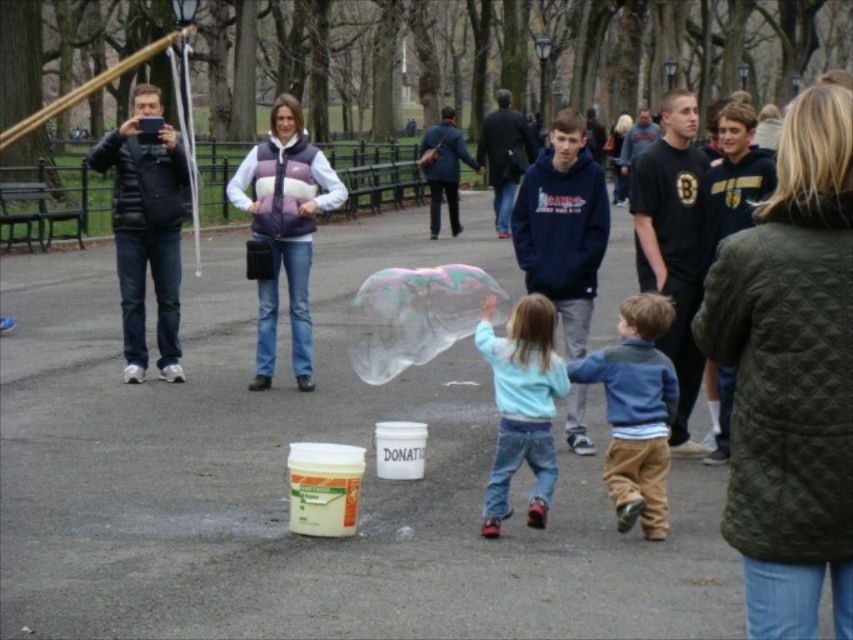
Question: Among these objects, which one is nearest to the camera?

Choices:
 (A) black cotton t-shirt at right
 (B) light blue fleece at center
 (C) blue fleece jacket at center

Answer: (C)

Question: Does black cotton t-shirt at right have a smaller size compared to blue fleece jacket at center?

Choices:
 (A) yes
 (B) no

Answer: (A)

Question: Does blue fleece jacket at center have a larger size compared to light blue fleece at center?

Choices:
 (A) yes
 (B) no

Answer: (B)

Question: Which of the following is the farthest from the observer?

Choices:
 (A) (685, 300)
 (B) (508, 451)
 (C) (646, 314)

Answer: (A)

Question: Does black cotton t-shirt at right appear on the left side of light blue fleece at center?

Choices:
 (A) no
 (B) yes

Answer: (A)

Question: Which point is farther to the camera?

Choices:
 (A) (541, 356)
 (B) (608, 387)

Answer: (B)